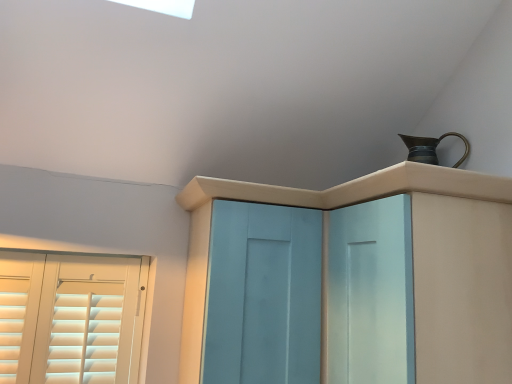
Question: Is light blue wood cupboard at upper center in front of or behind light blue wood screen door at center in the image?

Choices:
 (A) behind
 (B) front

Answer: (B)

Question: Choose the correct answer: Is light blue wood cupboard at upper center inside light blue wood screen door at center or outside it?

Choices:
 (A) outside
 (B) inside

Answer: (A)

Question: Which object is the closest to the bronze metallic jug at upper right?

Choices:
 (A) light blue wood cupboard at upper center
 (B) light blue wood screen door at center

Answer: (A)

Question: Which of these objects is positioned closest to the light blue wood screen door at center?

Choices:
 (A) light blue wood cupboard at upper center
 (B) bronze metallic jug at upper right

Answer: (A)